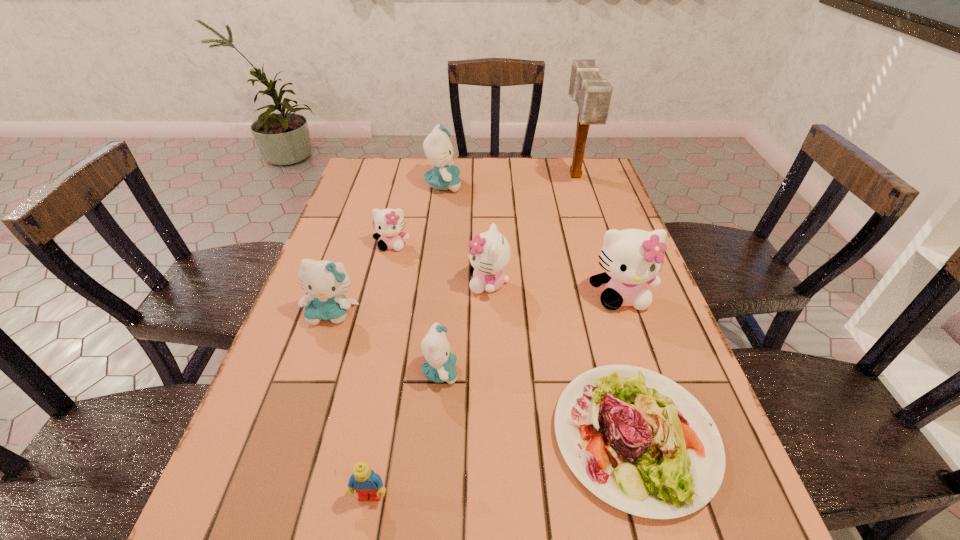
Image resolution: width=960 pixels, height=540 pixels. Find the location of `free space that satisfies the following two spatial constraints: 1. on the front-facing side of the second smallest white kitten; 2. on the left side of the green salad plate`. free space that satisfies the following two spatial constraints: 1. on the front-facing side of the second smallest white kitten; 2. on the left side of the green salad plate is located at coordinates (492, 436).

You are a GUI agent. You are given a task and a screenshot of the screen. Output one action in this format:
    pyautogui.click(x=<x>, y=<y>)
    Task: Click on the free spot that satisfies the following two spatial constraints: 1. on the front side of the mallet; 2. on the face of the nearest kitten
    The height and width of the screenshot is (540, 960).
    Given the screenshot: What is the action you would take?
    pyautogui.click(x=637, y=372)